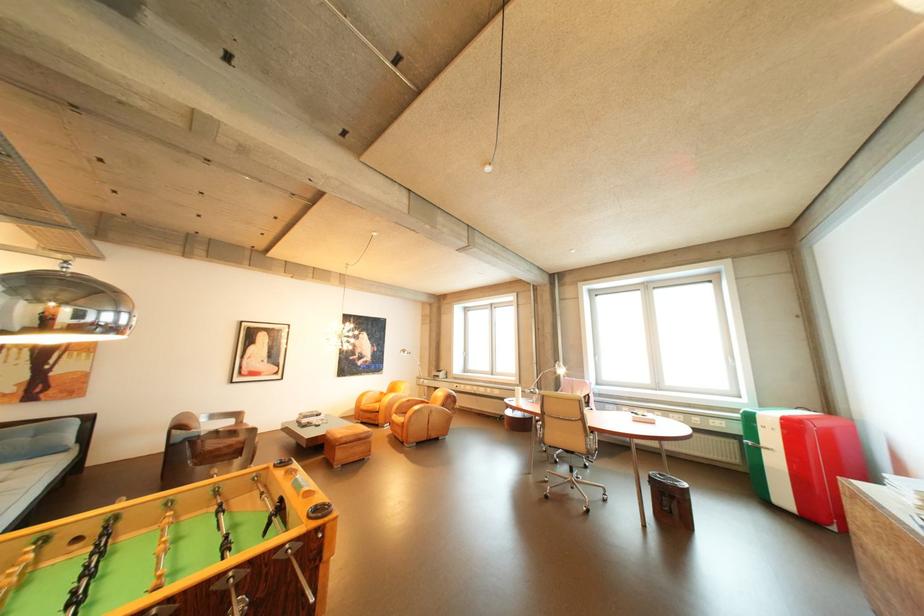
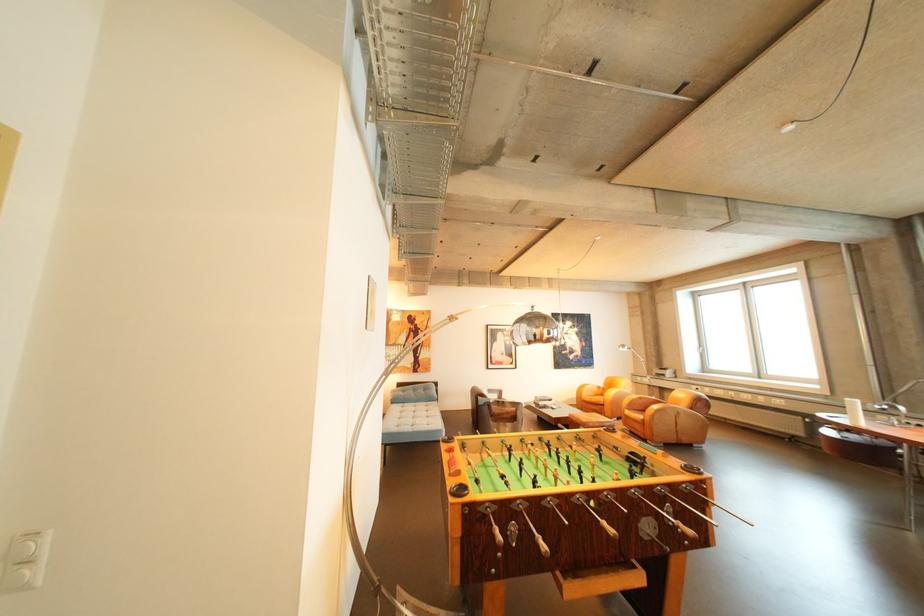
In the second image, find the point that corresponds to [377,395] in the first image.

(594, 387)